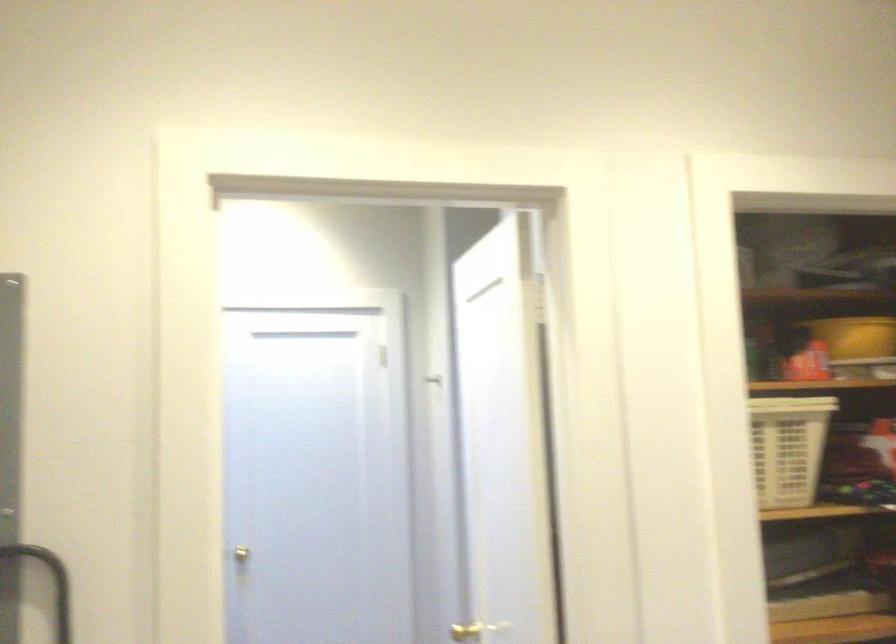
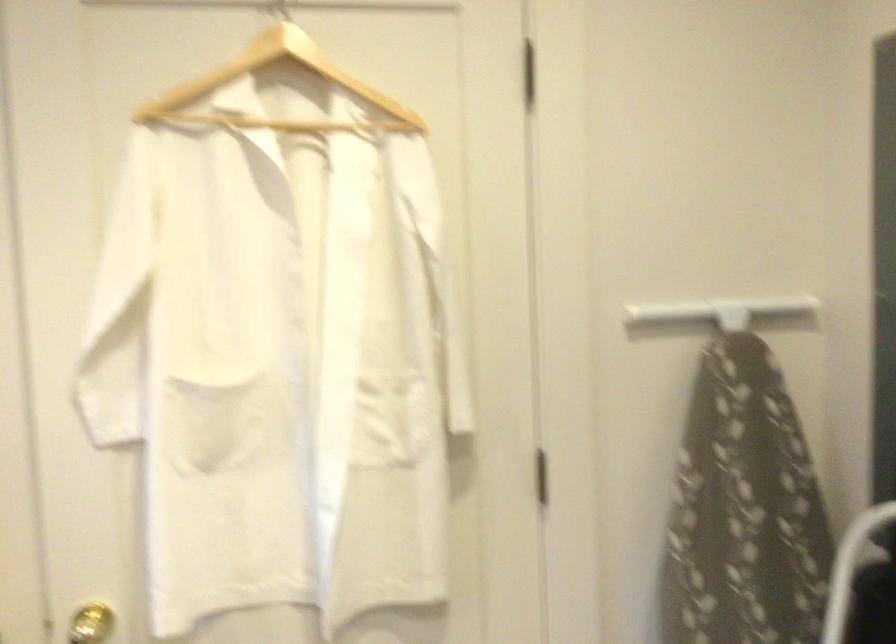
Question: The camera is either moving clockwise (left) or counter-clockwise (right) around the object. The first image is from the beginning of the video and the second image is from the end. Is the camera moving left or right when shooting the video?

Choices:
 (A) Left
 (B) Right

Answer: (B)